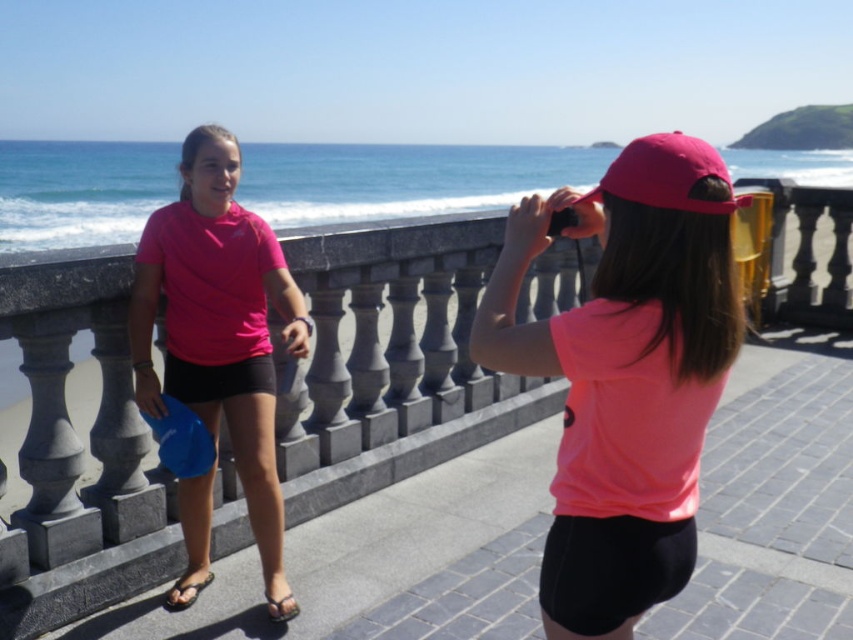
You are standing on the walkway and want to pick up the item located at point (640, 259). Your reach extends 4 feet. Can you reach it without moving?

The point (640, 259) is 5.29 feet away from the viewer, which is beyond your 4 feet reach. You cannot reach it without moving.